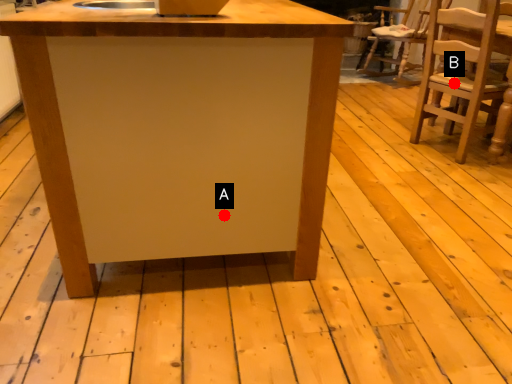
Question: Two points are circled on the image, labeled by A and B beside each circle. Among these points, which one is farthest from the camera?

Choices:
 (A) A is further
 (B) B is further

Answer: (B)